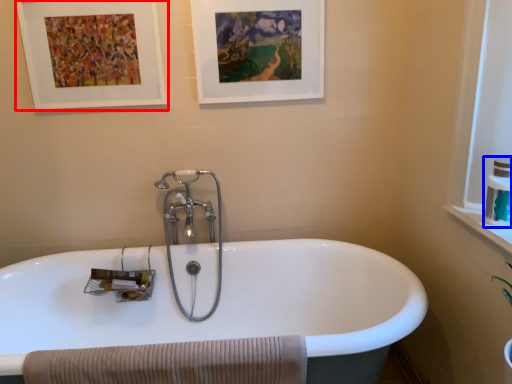
Question: Among these objects, which one is nearest to the camera, picture frame (highlighted by a red box) or toiletry (highlighted by a blue box)?

Choices:
 (A) picture frame
 (B) toiletry

Answer: (B)